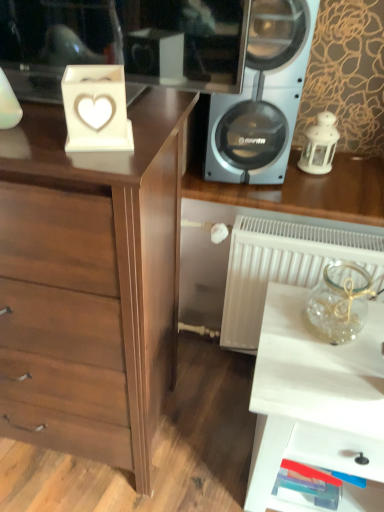
Find the location of `vacant area that lies in front of clear glass jar at right`. vacant area that lies in front of clear glass jar at right is located at coordinates (323, 373).